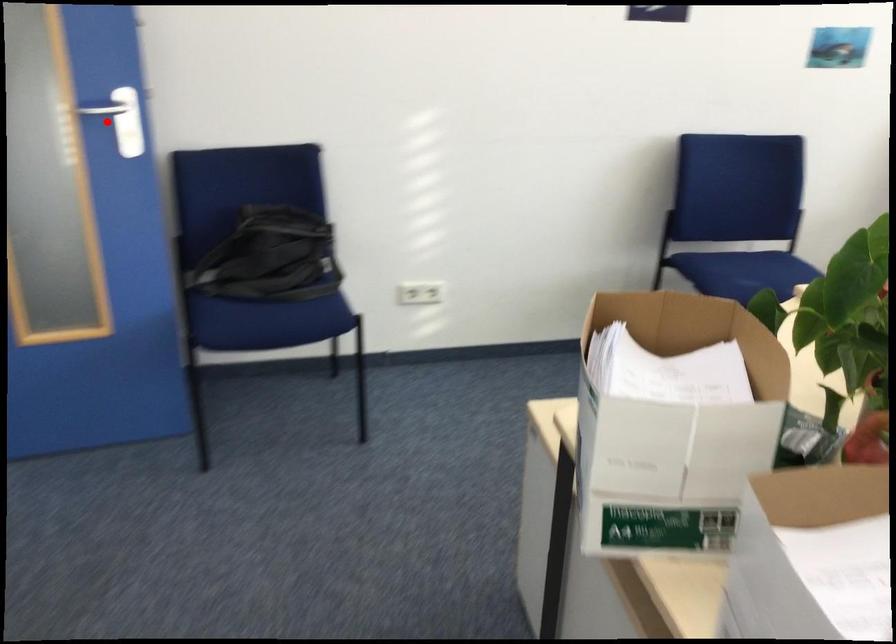
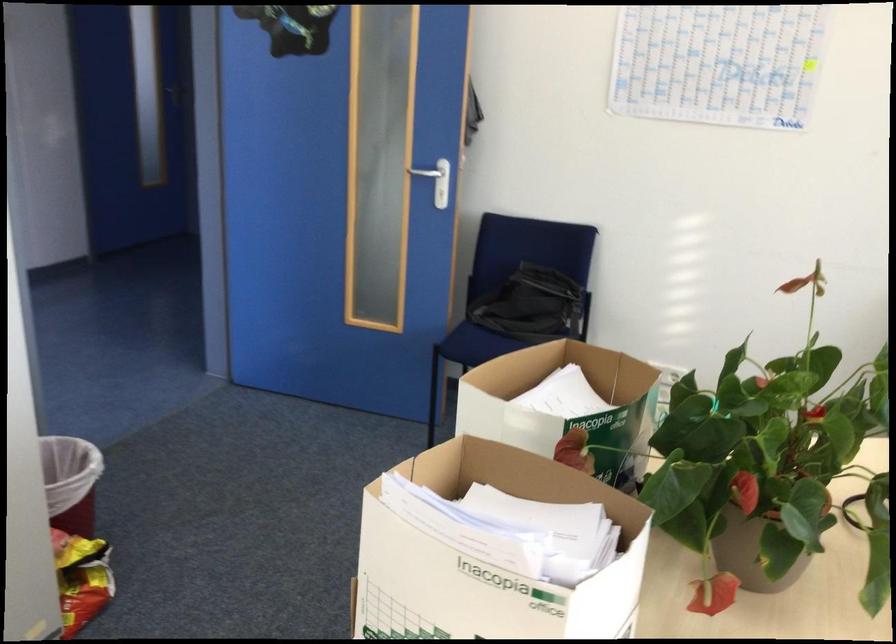
Where in the second image is the point corresponding to the highlighted location from the first image?

(424, 172)